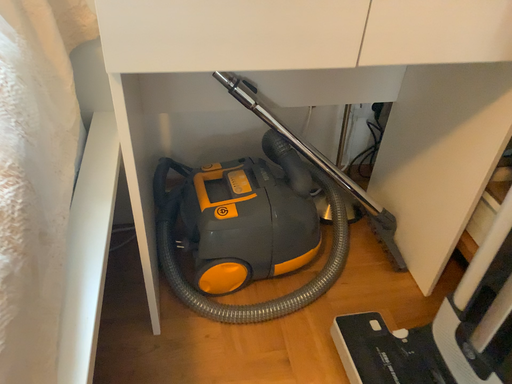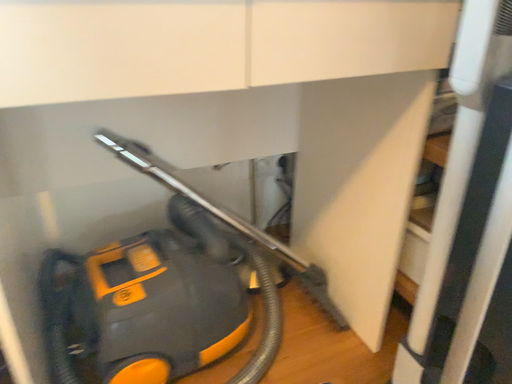
Question: Which way did the camera rotate in the video?

Choices:
 (A) rotated upward
 (B) rotated downward

Answer: (A)